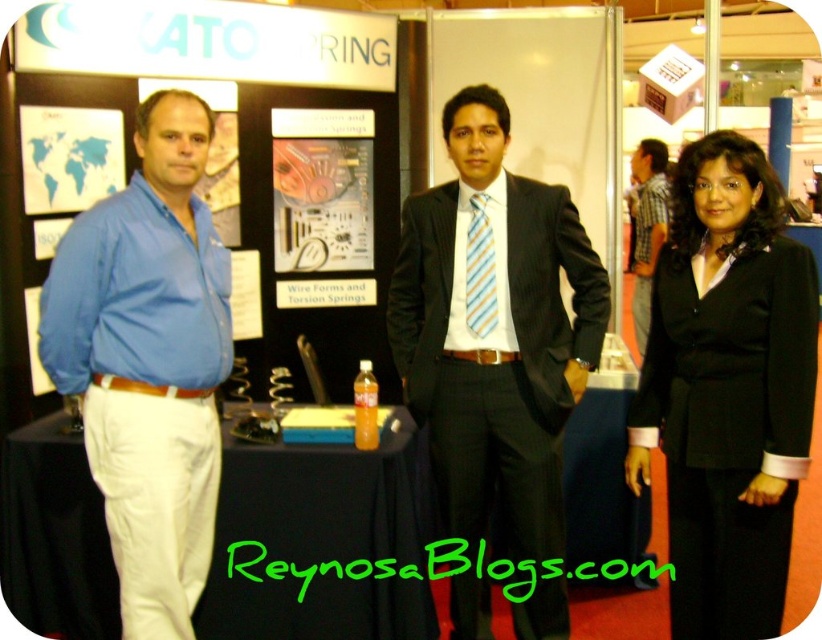
Question: Is the position of blue cotton shirt at left less distant than that of striped fabric tie at center?

Choices:
 (A) yes
 (B) no

Answer: (A)

Question: Does matte black suit at center appear over blue cotton shirt at left?

Choices:
 (A) yes
 (B) no

Answer: (B)

Question: Considering the relative positions of matte black suit at center and blue cotton shirt at left in the image provided, where is matte black suit at center located with respect to blue cotton shirt at left?

Choices:
 (A) right
 (B) left

Answer: (A)

Question: Which of the following is the farthest from the observer?

Choices:
 (A) (427, 312)
 (B) (770, 252)
 (C) (52, 202)
 (D) (481, 291)

Answer: (C)

Question: Which object is the closest to the blue cotton shirt at left?

Choices:
 (A) matte black suit at center
 (B) striped cotton shirt at right

Answer: (A)

Question: Among these objects, which one is nearest to the camera?

Choices:
 (A) blue map at upper left
 (B) striped cotton shirt at right
 (C) matte black suit at center

Answer: (C)